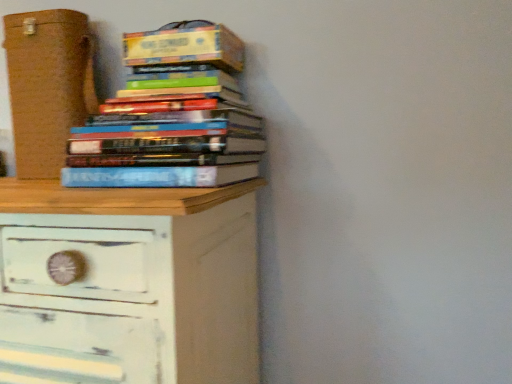
Question: Can you confirm if hardcover book at upper left is bigger than white distressed wood chest of drawers at lower left?

Choices:
 (A) yes
 (B) no

Answer: (B)

Question: Can you confirm if hardcover book at upper left is taller than white distressed wood chest of drawers at lower left?

Choices:
 (A) no
 (B) yes

Answer: (A)

Question: Is hardcover book at upper left positioned in front of white distressed wood chest of drawers at lower left?

Choices:
 (A) no
 (B) yes

Answer: (A)

Question: Is hardcover book at upper left aimed at white distressed wood chest of drawers at lower left?

Choices:
 (A) yes
 (B) no

Answer: (B)

Question: Is hardcover book at upper left oriented away from white distressed wood chest of drawers at lower left?

Choices:
 (A) yes
 (B) no

Answer: (B)

Question: Considering the positions of point (88, 249) and point (108, 185), is point (88, 249) closer or farther from the camera than point (108, 185)?

Choices:
 (A) farther
 (B) closer

Answer: (B)

Question: Based on their positions, is white distressed wood chest of drawers at lower left located to the left or right of hardcover books at upper center?

Choices:
 (A) right
 (B) left

Answer: (B)

Question: In the image, is white distressed wood chest of drawers at lower left positioned in front of or behind hardcover books at upper center?

Choices:
 (A) front
 (B) behind

Answer: (A)

Question: From the image's perspective, is white distressed wood chest of drawers at lower left positioned above or below hardcover books at upper center?

Choices:
 (A) above
 (B) below

Answer: (B)

Question: Considering their positions, is white distressed wood chest of drawers at lower left located in front of or behind hardcover book at upper left?

Choices:
 (A) front
 (B) behind

Answer: (A)

Question: From a real-world perspective, relative to hardcover book at upper left, is white distressed wood chest of drawers at lower left vertically above or below?

Choices:
 (A) below
 (B) above

Answer: (A)

Question: Is white distressed wood chest of drawers at lower left spatially inside hardcover book at upper left, or outside of it?

Choices:
 (A) inside
 (B) outside

Answer: (B)

Question: Considering the positions of white distressed wood chest of drawers at lower left and hardcover book at upper left in the image, is white distressed wood chest of drawers at lower left taller or shorter than hardcover book at upper left?

Choices:
 (A) short
 (B) tall

Answer: (B)

Question: Choose the correct answer: Is hardcover books at upper center inside brown cardboard box at left or outside it?

Choices:
 (A) inside
 (B) outside

Answer: (B)

Question: Is hardcover books at upper center in front of or behind brown cardboard box at left in the image?

Choices:
 (A) behind
 (B) front

Answer: (B)